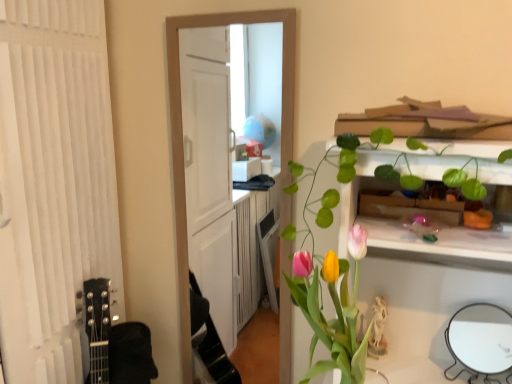
Question: Considering the relative positions of matte plastic vase with tulips at center and white glossy mirror at lower right in the image provided, is matte plastic vase with tulips at center behind white glossy mirror at lower right?

Choices:
 (A) no
 (B) yes

Answer: (A)

Question: Considering the relative sizes of matte plastic vase with tulips at center and white glossy mirror at lower right in the image provided, is matte plastic vase with tulips at center smaller than white glossy mirror at lower right?

Choices:
 (A) yes
 (B) no

Answer: (B)

Question: Can you confirm if matte plastic vase with tulips at center is thinner than white glossy mirror at lower right?

Choices:
 (A) yes
 (B) no

Answer: (B)

Question: From the image's perspective, is matte plastic vase with tulips at center under white glossy mirror at lower right?

Choices:
 (A) yes
 (B) no

Answer: (B)

Question: Does matte plastic vase with tulips at center come in front of white glossy mirror at lower right?

Choices:
 (A) no
 (B) yes

Answer: (B)

Question: Is matte plastic vase with tulips at center wider than white glossy mirror at lower right?

Choices:
 (A) yes
 (B) no

Answer: (A)

Question: Is white glossy mirror at lower right smaller than matte plastic vase with tulips at center?

Choices:
 (A) no
 (B) yes

Answer: (B)

Question: Would you say white glossy mirror at lower right is outside matte plastic vase with tulips at center?

Choices:
 (A) no
 (B) yes

Answer: (B)

Question: Is white glossy mirror at lower right surrounding matte plastic vase with tulips at center?

Choices:
 (A) no
 (B) yes

Answer: (A)

Question: From the image's perspective, would you say white glossy mirror at lower right is positioned over matte plastic vase with tulips at center?

Choices:
 (A) yes
 (B) no

Answer: (B)

Question: From the image's perspective, is white glossy mirror at lower right beneath matte plastic vase with tulips at center?

Choices:
 (A) yes
 (B) no

Answer: (A)

Question: Is white glossy mirror at lower right oriented away from matte plastic vase with tulips at center?

Choices:
 (A) yes
 (B) no

Answer: (B)

Question: Is white glossy mirror at lower right to the left or to the right of matte plastic vase with tulips at center in the image?

Choices:
 (A) right
 (B) left

Answer: (A)